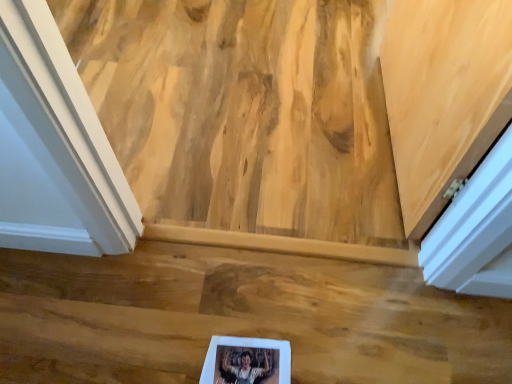
Locate an element on the screen. The height and width of the screenshot is (384, 512). free space above wooden floor at center (from a real-world perspective) is located at coordinates (206, 314).